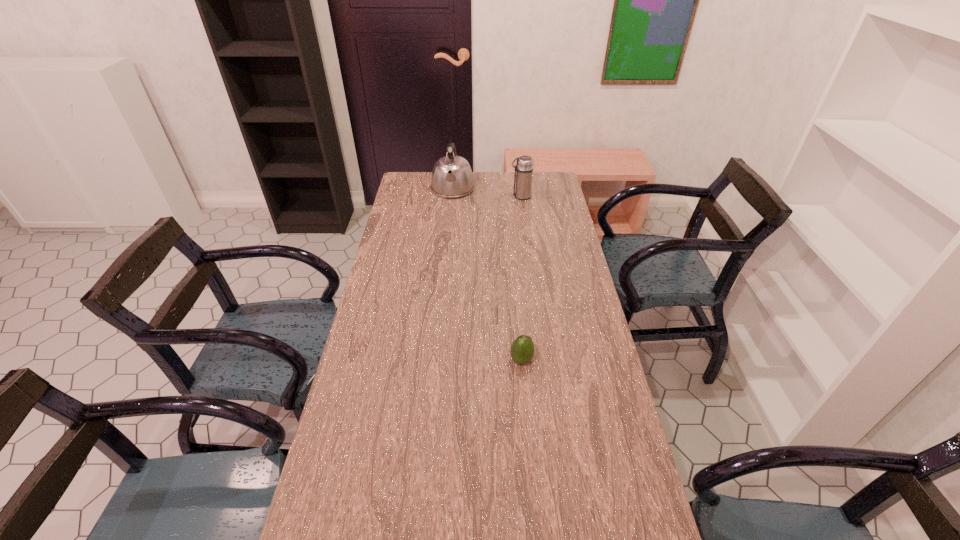
The image size is (960, 540). What are the coordinates of `free space between the shortest object and the leftmost object` in the screenshot? It's located at (487, 275).

Where is `vacant area that lies between the leftmost object and the thermos bottle`? The width and height of the screenshot is (960, 540). vacant area that lies between the leftmost object and the thermos bottle is located at coordinates (487, 193).

Where is `vacant space that's between the second tallest object and the tallest object`? vacant space that's between the second tallest object and the tallest object is located at coordinates (487, 193).

Find the location of a particular element. free space between the leftmost object and the second shortest object is located at coordinates (487, 193).

Locate an element on the screen. unoccupied position between the shortest object and the kettle is located at coordinates 487,275.

Locate an element on the screen. This screenshot has width=960, height=540. blank region between the second shortest object and the nearest object is located at coordinates (521, 278).

Where is `object that is the second closest one to the kettle`? The image size is (960, 540). object that is the second closest one to the kettle is located at coordinates (522, 349).

Find the location of a particular element. The width and height of the screenshot is (960, 540). the second closest object to the thermos bottle is located at coordinates (522, 349).

Where is `free location that satisfies the following two spatial constraints: 1. with a handle on the side of the second tallest object; 2. on the front side of the shortest object`? free location that satisfies the following two spatial constraints: 1. with a handle on the side of the second tallest object; 2. on the front side of the shortest object is located at coordinates (543, 360).